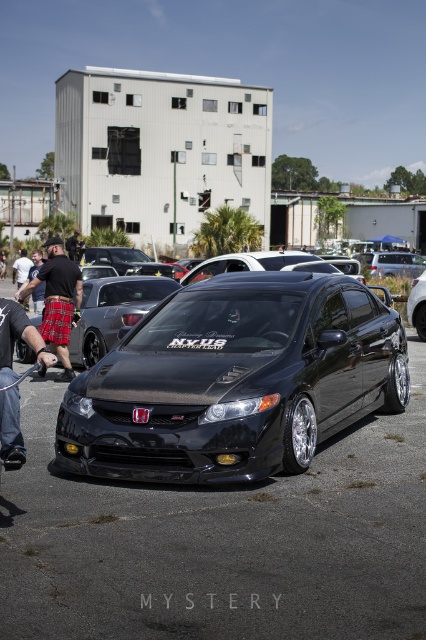
You are standing at the center of the paved lot and want to walk to the black leather pants at lower left. Which direction should you move to reach them?

The black leather pants at lower left are located at point [17,337], so you should move towards the lower left direction from your current position at the center to reach them.

You are a photographer at the car meet and want to capture both the black polished car at center and the black fabric shorts at lower left in a single shot. Which object should you position closer to the edge of the frame to ensure both are visible?

The black fabric shorts at lower left should be positioned closer to the edge of the frame since the black polished car at center is on the right side of the black fabric shorts at lower left, meaning the car is already shifted towards the right relative to the shorts. By placing the shorts near the edge, there will be enough space to include the car towards the center and right side of the frame.